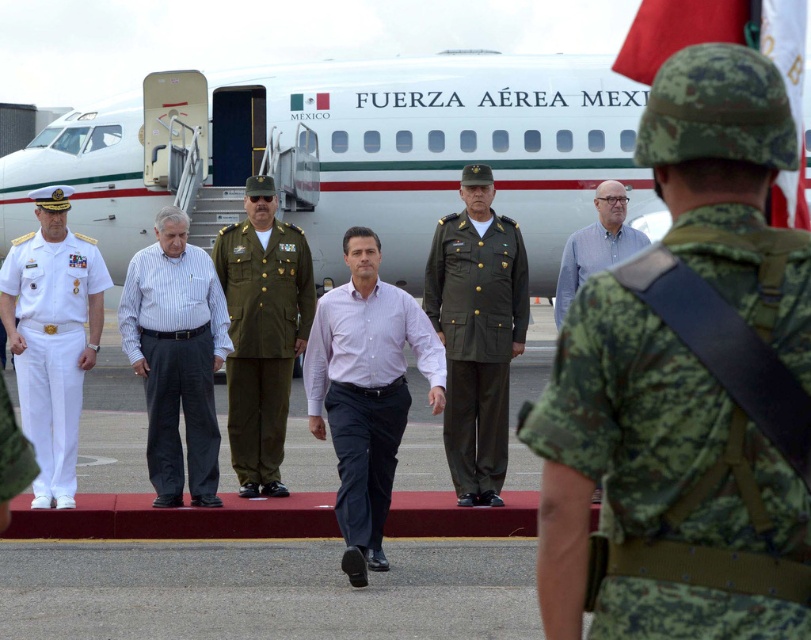
Question: Which object is the farthest from the green military uniform at center?

Choices:
 (A) olive green fabric uniform at center
 (B) light blue shirt at center
 (C) white striped shirt at center
 (D) camo fabric uniform at center

Answer: (D)

Question: Can you confirm if purple cotton shirt at center is smaller than olive green fabric uniform at center?

Choices:
 (A) yes
 (B) no

Answer: (B)

Question: Which point is closer to the camera?

Choices:
 (A) (728, 525)
 (B) (176, 273)
 (C) (500, 410)

Answer: (A)

Question: Can you confirm if camo fabric uniform at center is positioned above light blue shirt at center?

Choices:
 (A) no
 (B) yes

Answer: (A)

Question: Is white cotton dress uniform at left in front of olive green fabric uniform at center?

Choices:
 (A) no
 (B) yes

Answer: (B)

Question: Which object is closer to the camera taking this photo?

Choices:
 (A) green military uniform at center
 (B) light blue shirt at center

Answer: (A)